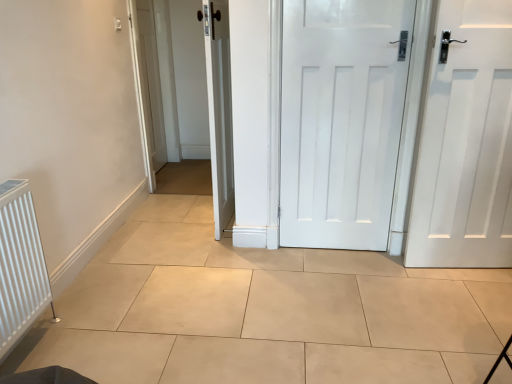
Where is `free space on the front side of white wooden door at center, which is counted as the 3th door, starting from the right`? Image resolution: width=512 pixels, height=384 pixels. free space on the front side of white wooden door at center, which is counted as the 3th door, starting from the right is located at coordinates (221, 254).